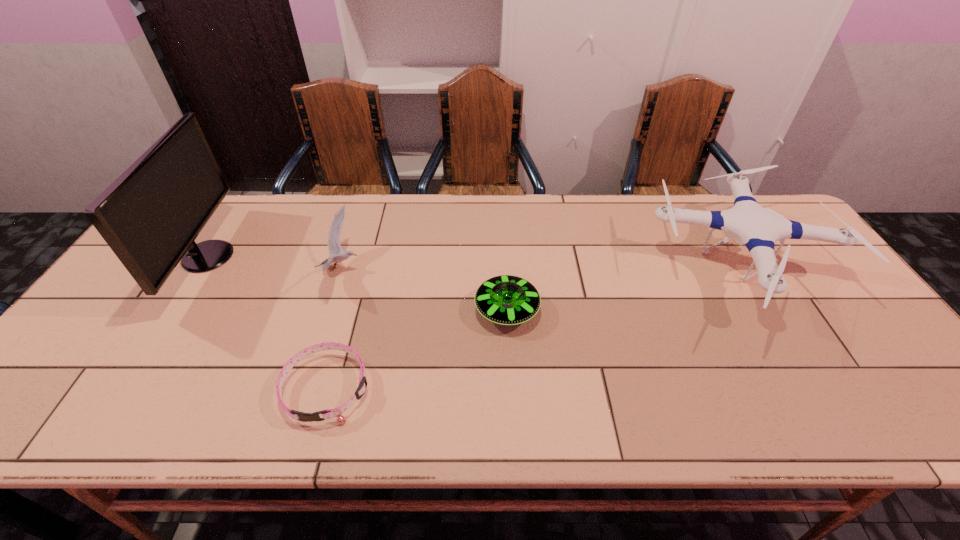
At what (x,y) coordinates should I click in order to perform the action: click on object that is at the far right corner. Please return your answer as a coordinate pair (x, y). This screenshot has height=540, width=960. Looking at the image, I should click on (748, 223).

Locate an element on the screen. This screenshot has height=540, width=960. vacant area at the far edge of the desktop is located at coordinates (541, 225).

The height and width of the screenshot is (540, 960). I want to click on vacant space at the near edge of the desktop, so click(x=100, y=421).

Where is `vacant space at the left edge of the desktop`? vacant space at the left edge of the desktop is located at coordinates (92, 324).

This screenshot has height=540, width=960. I want to click on vacant space at the right edge, so click(x=868, y=321).

In order to click on free space between the leftmost object and the rightmost object in this screenshot , I will do `click(473, 262)`.

Find the location of a particular element. vacant point located between the nearest object and the tallest object is located at coordinates (268, 322).

Where is `vacant area that lies between the nearest object and the drone`? The width and height of the screenshot is (960, 540). vacant area that lies between the nearest object and the drone is located at coordinates (x=533, y=328).

This screenshot has height=540, width=960. What are the coordinates of `free spot between the second tallest object and the computer monitor` in the screenshot? It's located at (473, 262).

Where is `free spot between the tallest object and the third tallest object`? The image size is (960, 540). free spot between the tallest object and the third tallest object is located at coordinates (275, 263).